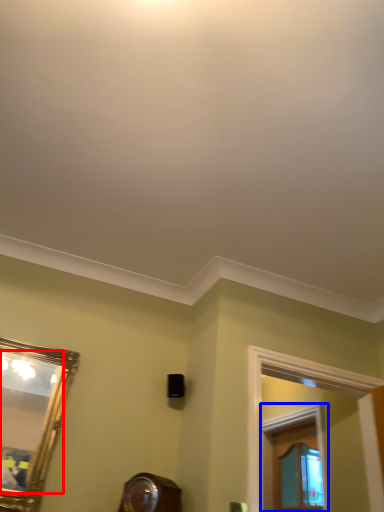
Question: Which object is further to the camera taking this photo, mirror (highlighted by a red box) or window frame (highlighted by a blue box)?

Choices:
 (A) mirror
 (B) window frame

Answer: (B)